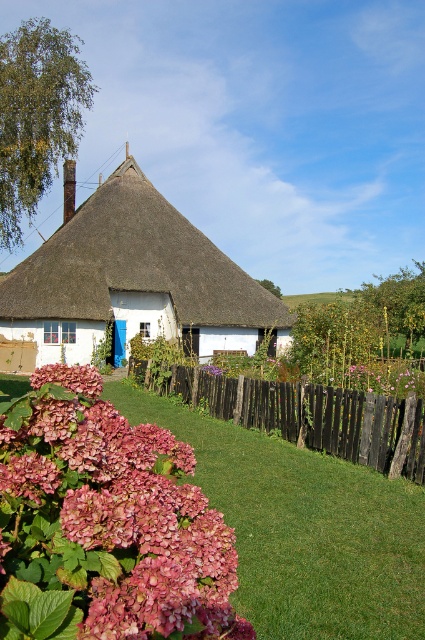
Question: Does white thatched roof at center have a larger size compared to black wooden fence at lower center?

Choices:
 (A) no
 (B) yes

Answer: (B)

Question: Among these points, which one is nearest to the camera?

Choices:
 (A) (221, 545)
 (B) (209, 385)
 (C) (204, 321)

Answer: (A)

Question: Can you confirm if white thatched roof at center is thinner than black wooden fence at lower center?

Choices:
 (A) yes
 (B) no

Answer: (B)

Question: Is white thatched roof at center to the left of black wooden fence at lower center from the viewer's perspective?

Choices:
 (A) yes
 (B) no

Answer: (A)

Question: Which point is closer to the camera?

Choices:
 (A) (183, 220)
 (B) (360, 394)

Answer: (B)

Question: Which point appears farthest from the camera in this image?

Choices:
 (A) (34, 269)
 (B) (235, 381)
 (C) (164, 627)

Answer: (A)